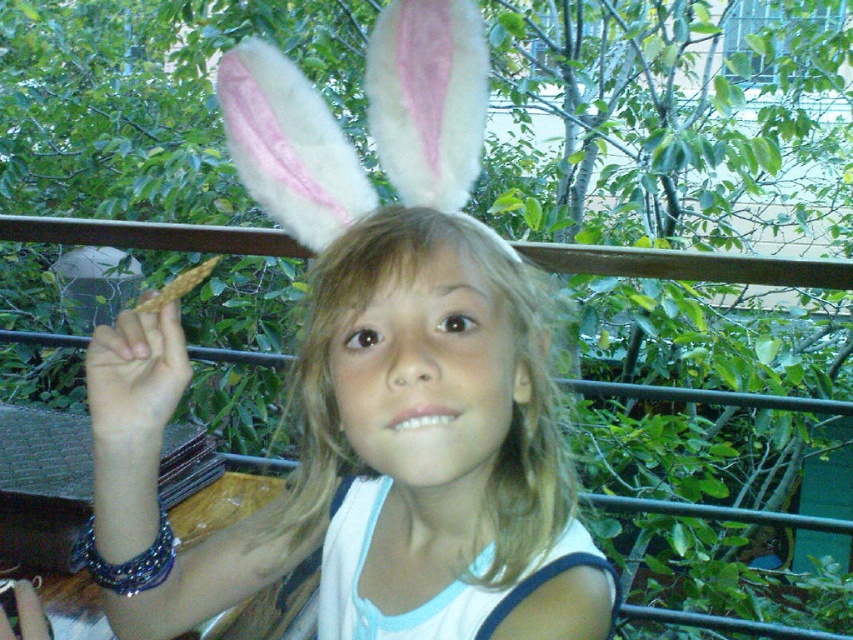
You are a photographer trying to capture the child in the scene. The camera frame can only accommodate objects up to the width of the matte white head at center. Will the white fluffy bunny ears at upper center fit within the frame?

The white fluffy bunny ears at upper center might be wider than matte white head at center, so there is a possibility that they may not fit within the camera frame designed for the width of the matte white head at center.

Based on the scene description, can you determine if the white fluffy bunny ears at upper center are positioned above or below the matte white head at center?

The white fluffy bunny ears at upper center are located above the matte white head at center.